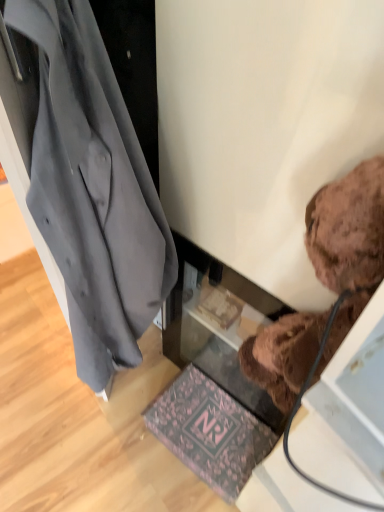
Question: Can you confirm if brown plush teddy bear at upper right is smaller than pink floral mat at lower center?

Choices:
 (A) yes
 (B) no

Answer: (B)

Question: Would you say brown plush teddy bear at upper right contains pink floral mat at lower center?

Choices:
 (A) yes
 (B) no

Answer: (B)

Question: Does brown plush teddy bear at upper right have a greater height compared to pink floral mat at lower center?

Choices:
 (A) no
 (B) yes

Answer: (B)

Question: Is brown plush teddy bear at upper right outside of pink floral mat at lower center?

Choices:
 (A) yes
 (B) no

Answer: (A)

Question: Does brown plush teddy bear at upper right have a larger size compared to pink floral mat at lower center?

Choices:
 (A) yes
 (B) no

Answer: (A)

Question: Considering the positions of brown plush teddy bear at upper right and dark gray fabric coat at left in the image, is brown plush teddy bear at upper right taller or shorter than dark gray fabric coat at left?

Choices:
 (A) tall
 (B) short

Answer: (B)

Question: Is point (316, 270) closer or farther from the camera than point (124, 308)?

Choices:
 (A) farther
 (B) closer

Answer: (B)

Question: Visually, is brown plush teddy bear at upper right positioned to the left or to the right of dark gray fabric coat at left?

Choices:
 (A) right
 (B) left

Answer: (A)

Question: Looking at their shapes, would you say brown plush teddy bear at upper right is wider or thinner than dark gray fabric coat at left?

Choices:
 (A) wide
 (B) thin

Answer: (B)

Question: From a real-world perspective, is pink floral mat at lower center positioned above or below brown plush teddy bear at upper right?

Choices:
 (A) above
 (B) below

Answer: (B)

Question: Would you say pink floral mat at lower center is to the left or to the right of brown plush teddy bear at upper right in the picture?

Choices:
 (A) right
 (B) left

Answer: (B)

Question: In the image, is pink floral mat at lower center positioned in front of or behind brown plush teddy bear at upper right?

Choices:
 (A) front
 (B) behind

Answer: (B)

Question: In terms of width, does pink floral mat at lower center look wider or thinner when compared to brown plush teddy bear at upper right?

Choices:
 (A) wide
 (B) thin

Answer: (A)

Question: Would you say dark gray fabric coat at left is to the left or to the right of pink floral mat at lower center in the picture?

Choices:
 (A) left
 (B) right

Answer: (A)

Question: Would you say dark gray fabric coat at left is inside or outside pink floral mat at lower center?

Choices:
 (A) inside
 (B) outside

Answer: (B)